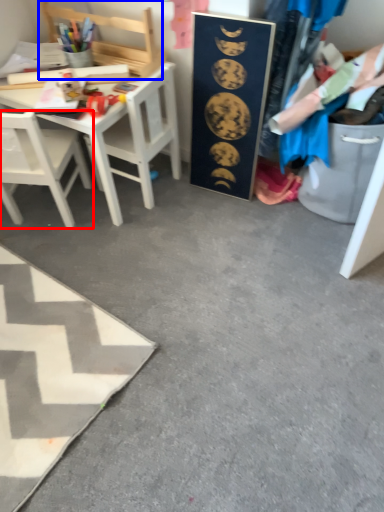
Question: Which object is closer to the camera taking this photo, chair (highlighted by a red box) or chair (highlighted by a blue box)?

Choices:
 (A) chair
 (B) chair

Answer: (A)